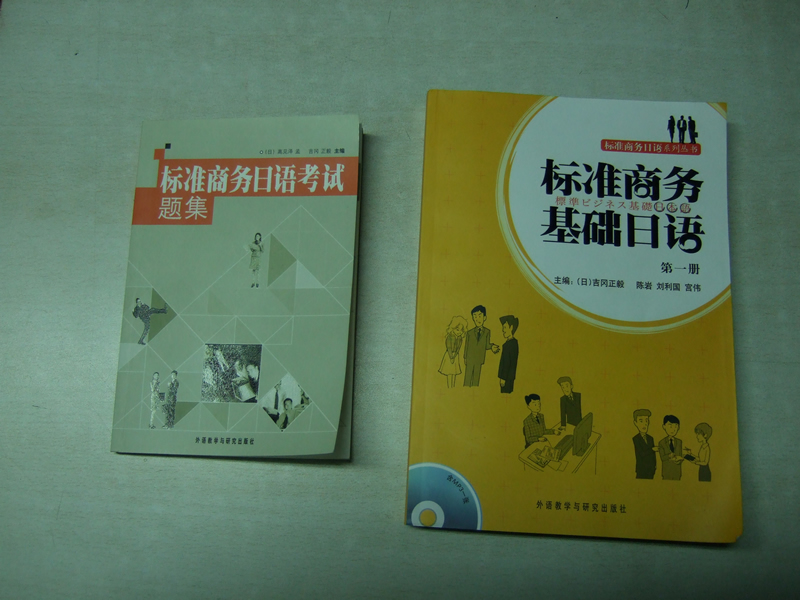
Where is `book on the left`? Image resolution: width=800 pixels, height=600 pixels. book on the left is located at coordinates (212, 280).